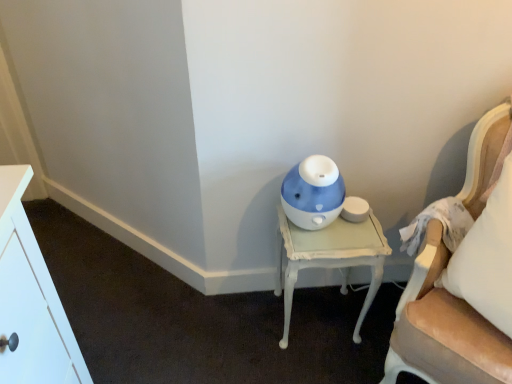
The width and height of the screenshot is (512, 384). I want to click on vacant space underneath white painted wood nightstand at lower right (from a real-world perspective), so click(311, 314).